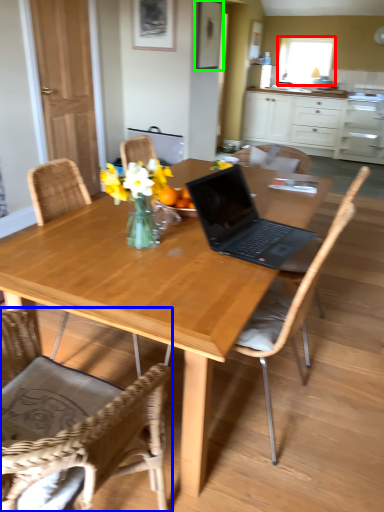
Question: Considering the real-world distances, which object is closest to window screen (highlighted by a red box)? chair (highlighted by a blue box) or picture frame (highlighted by a green box).

Choices:
 (A) chair
 (B) picture frame

Answer: (B)